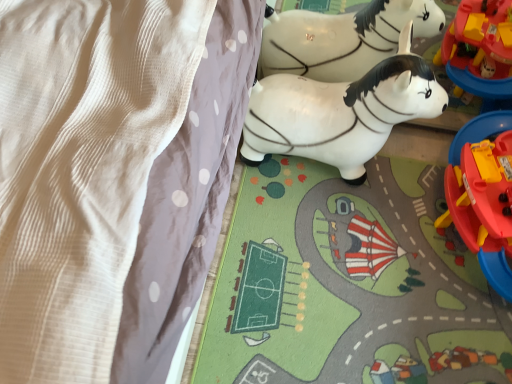
Question: Is white glossy plastic horse at center, marked as the 1th toy in a left-to-right arrangement, taller or shorter than matte plastic playset at right, the second toy viewed from the left?

Choices:
 (A) short
 (B) tall

Answer: (B)

Question: From the image's perspective, is white glossy plastic horse at center, which is the second toy in right-to-left order, above or below matte plastic playset at right, which ranks as the first toy in right-to-left order?

Choices:
 (A) above
 (B) below

Answer: (A)

Question: Considering the real-world distances, which object is closest to the white textured blanket at upper left?

Choices:
 (A) matte plastic playset at right, which ranks as the first toy in right-to-left order
 (B) white glossy plastic horse at center, which is the second toy in right-to-left order

Answer: (B)

Question: Which object is the closest to the white textured blanket at upper left?

Choices:
 (A) matte plastic playset at right, which ranks as the first toy in right-to-left order
 (B) white glossy plastic horse at center, which is the second toy in right-to-left order

Answer: (B)